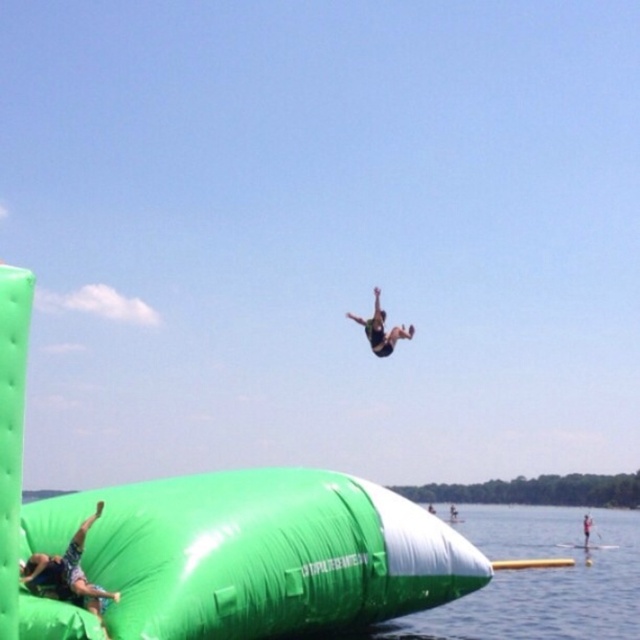
Question: Is reddish-brown wooden paddleboard at center above smooth white surfboard at center?

Choices:
 (A) yes
 (B) no

Answer: (A)

Question: Is camouflage fabric person at lower left to the right of smooth white surfboard at center from the viewer's perspective?

Choices:
 (A) no
 (B) yes

Answer: (A)

Question: Considering the real-world distances, which object is closest to the green fabric person at center?

Choices:
 (A) reddish-brown wooden paddleboard at center
 (B) smooth white surfboard at center

Answer: (B)

Question: Which is farther from the black fabric person at center?

Choices:
 (A) smooth white surfboard at center
 (B) green fabric person at center
 (C) camouflage fabric person at lower left
 (D) reddish-brown wooden paddleboard at center

Answer: (B)

Question: Does reddish-brown wooden paddleboard at center have a lesser width compared to smooth white surfboard at center?

Choices:
 (A) yes
 (B) no

Answer: (A)

Question: Which point appears closest to the camera in this image?

Choices:
 (A) (451, 520)
 (B) (45, 570)
 (C) (429, 512)
 (D) (388, 352)

Answer: (B)